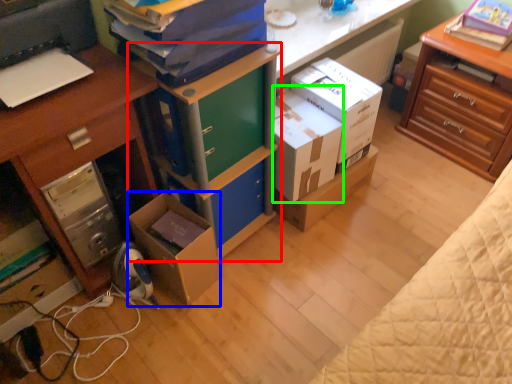
Question: Based on their relative distances, which object is nearer to bookshelf (highlighted by a red box)? Choose from box (highlighted by a blue box) and box (highlighted by a green box).

Choices:
 (A) box
 (B) box

Answer: (B)